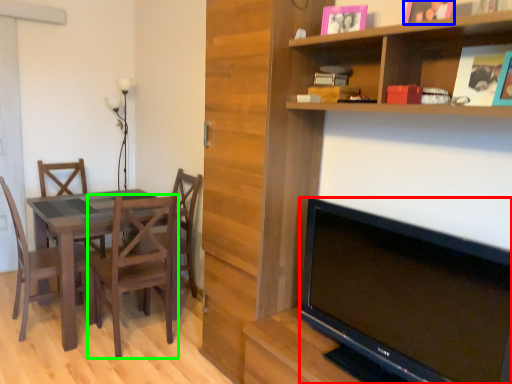
Question: Which object is the closest to the television (highlighted by a red box)? Choose among these: picture frame (highlighted by a blue box) or chair (highlighted by a green box).

Choices:
 (A) picture frame
 (B) chair

Answer: (A)